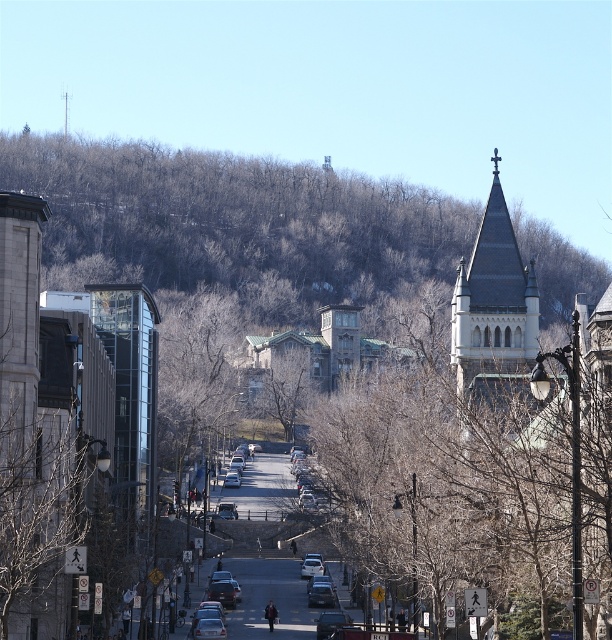
Question: Can you confirm if bare branches at center is bigger than brown leafless tree at center?

Choices:
 (A) yes
 (B) no

Answer: (A)

Question: From the image, what is the correct spatial relationship of bare branches at center in relation to brown leafless tree at center?

Choices:
 (A) right
 (B) left

Answer: (A)

Question: Is bare branches at center to the right of brown leafless tree at center from the viewer's perspective?

Choices:
 (A) yes
 (B) no

Answer: (A)

Question: Which object appears farthest from the camera in this image?

Choices:
 (A) brown leafless tree at center
 (B) bare branches at left
 (C) bare branches at center

Answer: (A)

Question: Which object is positioned closest to the bare branches at left?

Choices:
 (A) brown leafless tree at center
 (B) bare branches at center

Answer: (B)

Question: Which point is farther to the camera?

Choices:
 (A) (67, 438)
 (B) (296, 396)

Answer: (B)